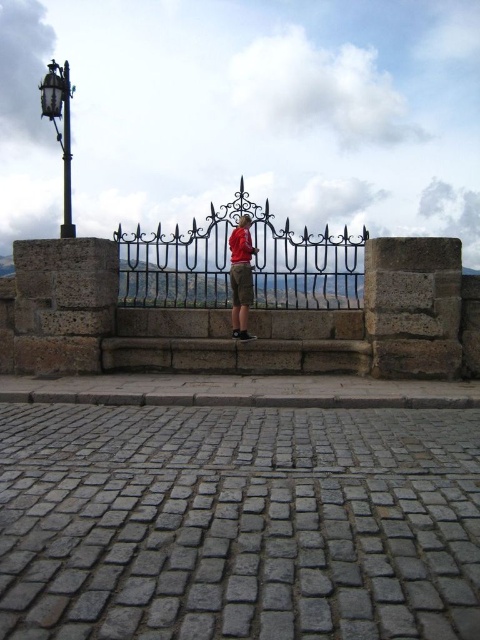
You are standing at the entrance of the historical site and need to reach the information kiosk located at coordinates point A. The wrought iron fence at center is in your way. Can you walk around it to the left or right side to reach point A?

The wrought iron fence at center is located at point (252, 264). Since the fence is at the center, you can walk around it either to the left or right side to reach point A.

You are a photographer trying to capture both the wrought iron fence at center and the red shirt at center in a single frame. Based on their sizes, which object should you focus on first to ensure both are in focus?

The wrought iron fence at center is bigger than the red shirt at center, so focusing on the wrought iron fence at center first will help ensure both are in focus since it occupies more of the frame.